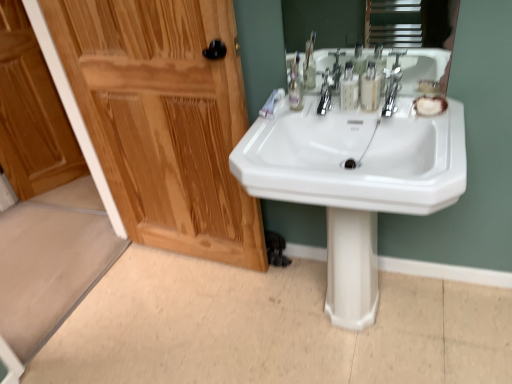
Question: From a real-world perspective, is chrome metallic faucet at upper center positioned above or below shiny wood door at left?

Choices:
 (A) above
 (B) below

Answer: (A)

Question: Looking at the image, does chrome metallic faucet at upper center seem bigger or smaller compared to shiny wood door at left?

Choices:
 (A) big
 (B) small

Answer: (B)

Question: Estimate the real-world distances between objects in this image. Which object is farther from the chrome metallic faucet at upper center?

Choices:
 (A) translucent plastic mouthwash at center, which is the second mouthwash from left to right
 (B) shiny wood door at left
 (C) white glossy sink at center
 (D) translucent plastic mouthwash at upper center, which is counted as the 1th mouthwash, starting from the left
 (E) white matte toothpaste at upper right

Answer: (B)

Question: Which object is the closest to the white glossy sink at center?

Choices:
 (A) translucent plastic mouthwash at upper center, which is counted as the 1th mouthwash, starting from the left
 (B) shiny wood door at left
 (C) white glossy pedestal at center
 (D) white matte soap at right
 (E) translucent plastic mouthwash at center, arranged as the first mouthwash when viewed from the right

Answer: (A)